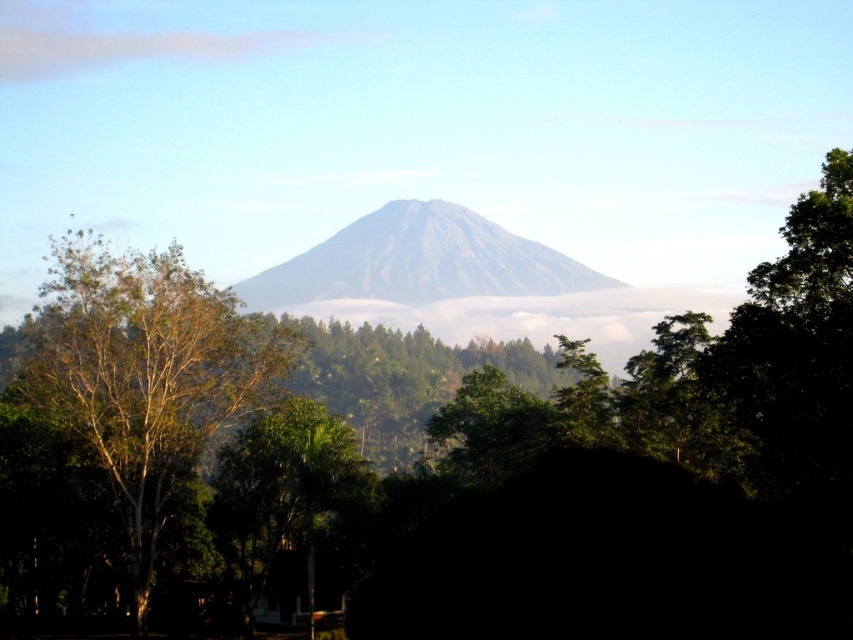
Question: Which point appears closest to the camera in this image?

Choices:
 (A) (85, 300)
 (B) (316, 252)
 (C) (289, 403)

Answer: (A)

Question: Which point is farther from the camera taking this photo?

Choices:
 (A) (78, 364)
 (B) (529, 289)
 (C) (322, 408)

Answer: (B)

Question: Is gray matte mountain at center to the right of green leafy tree at lower center from the viewer's perspective?

Choices:
 (A) yes
 (B) no

Answer: (A)

Question: Is green leafy tree at center in front of green leafy tree at lower center?

Choices:
 (A) yes
 (B) no

Answer: (A)

Question: From the image, what is the correct spatial relationship of gray matte mountain at center in relation to green leafy tree at lower center?

Choices:
 (A) right
 (B) left

Answer: (A)

Question: Which of the following is the farthest from the observer?

Choices:
 (A) (469, 218)
 (B) (100, 337)
 (C) (312, 524)

Answer: (A)